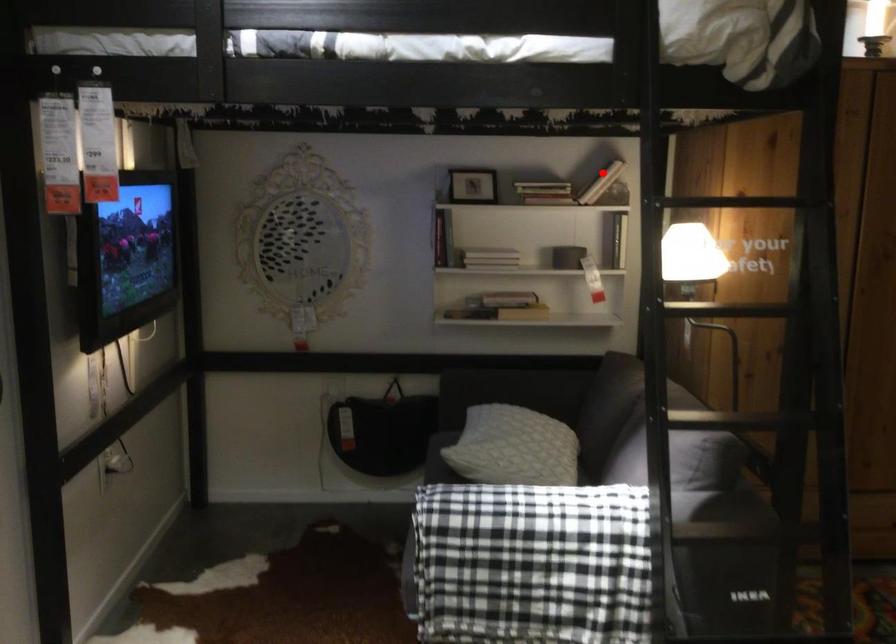
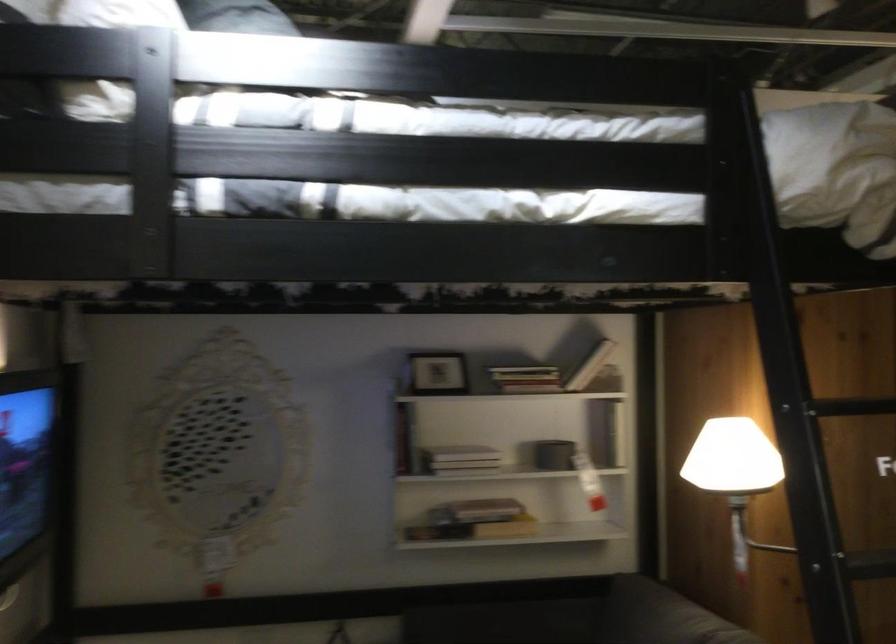
Find the pixel in the second image that matches the highlighted location in the first image.

(590, 366)